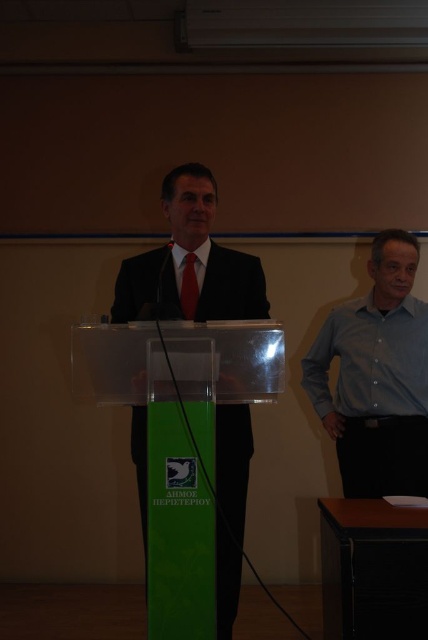
Does light blue button-down shirt at right appear on the left side of green plastic podium at center?

Incorrect, light blue button-down shirt at right is not on the left side of green plastic podium at center.

Can you confirm if light blue button-down shirt at right is taller than green plastic podium at center?

Indeed, light blue button-down shirt at right has a greater height compared to green plastic podium at center.

Does point (309, 349) lie in front of point (406, 557)?

No, it is behind (406, 557).

I want to click on light blue button-down shirt at right, so click(x=377, y=378).

Is matte black suit at center bigger than red satin tie at center?

Indeed, matte black suit at center has a larger size compared to red satin tie at center.

Is point (261, 310) behind point (189, 314)?

Yes, it is behind point (189, 314).

Identify the location of matte black suit at center. (195, 262).

Locate an element on the screen. The height and width of the screenshot is (640, 428). light blue button-down shirt at right is located at coordinates (377, 378).

Measure the distance between point (371, 355) and camera.

The distance of point (371, 355) from camera is 2.56 meters.

Identify the location of light blue button-down shirt at right. The image size is (428, 640). (377, 378).